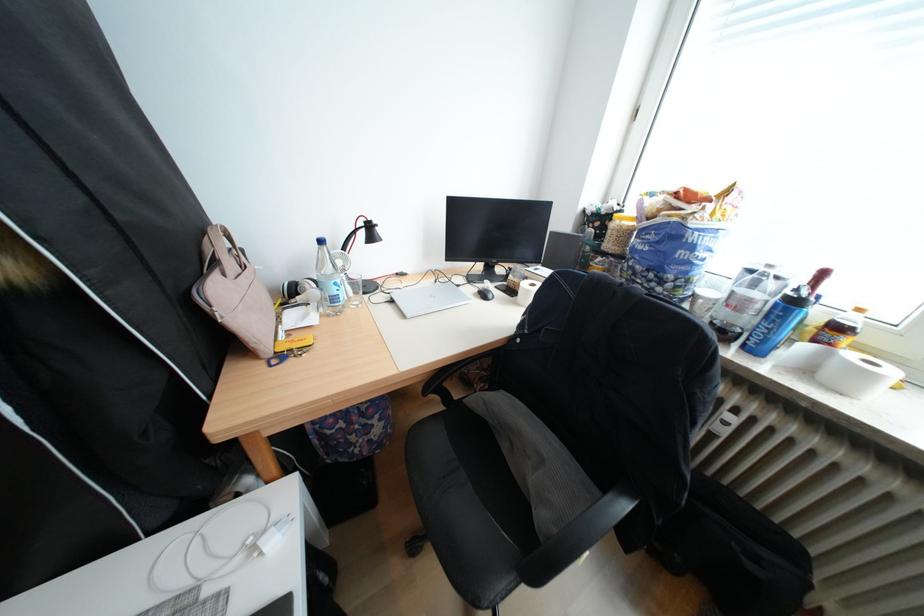
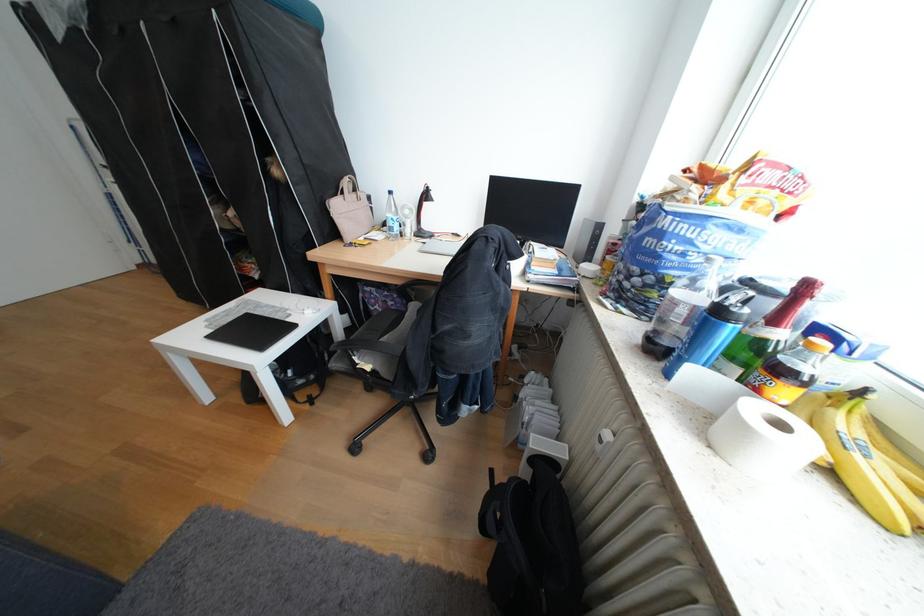
Where in the second image is the point corresponding to point 835,275 from the first image?

(819, 288)